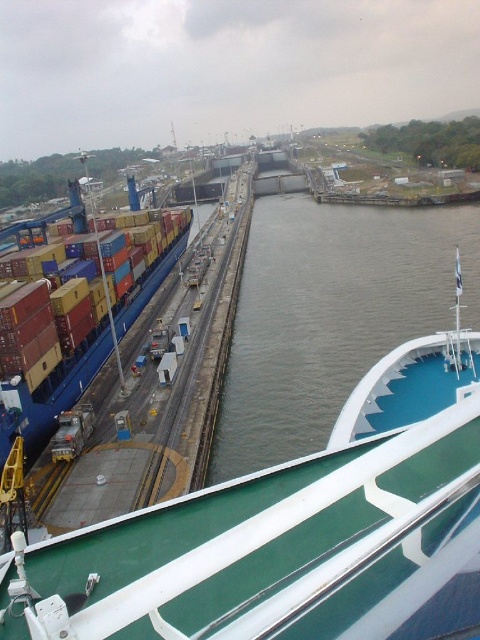
You are an engineer assessing the height of the green matte boat at center and the green smooth water at center in the Panama Canal scene. Which object is shorter in height?

The green matte boat at center is not as tall as the green smooth water at center, so the boat is shorter in height.

You are a marine biologist on a research vessel and need to collect water samples from the green smooth water at center. Your equipment requires you to be within 15 meters to operate safely. Can you operate your equipment while staying on the green matte boat at center?

The green matte boat at center is 14.95 meters away from the green smooth water at center. Since the distance is within the 15 meters safety requirement, you can operate your equipment safely while staying on the green matte boat at center.

You are standing on the deck of a ship in the Panama Canal. You see a point marked at coordinates (291, 531). What object is located at this point?

The point at coordinates (291, 531) corresponds to the green matte boat at center.